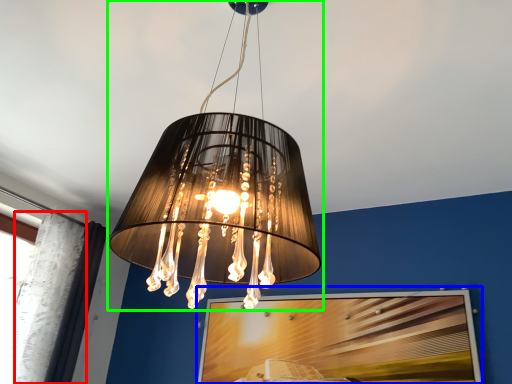
Question: Which object is positioned farthest from curtain (highlighted by a red box)? Select from picture frame (highlighted by a blue box) and lamp (highlighted by a green box).

Choices:
 (A) picture frame
 (B) lamp

Answer: (B)